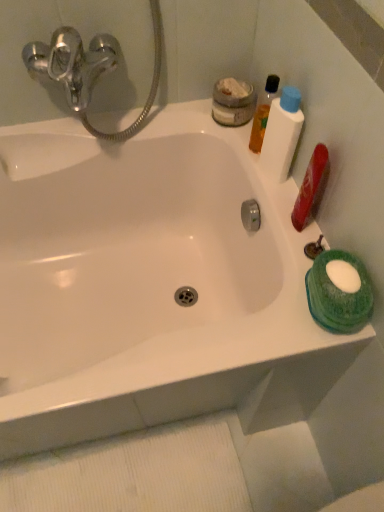
Identify the location of free space in front of red matte bottle at right, which is counted as the second mouthwash, starting from the bottom. The width and height of the screenshot is (384, 512). (294, 270).